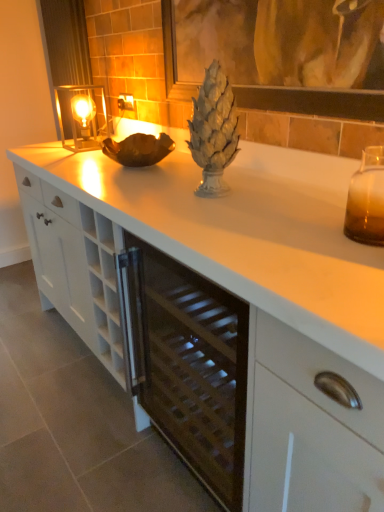
Question: Considering the positions of white matte cabinet at center and metallic silver curtain at upper left in the image, is white matte cabinet at center taller or shorter than metallic silver curtain at upper left?

Choices:
 (A) tall
 (B) short

Answer: (A)

Question: Considering the positions of white matte cabinet at center and metallic silver curtain at upper left in the image, is white matte cabinet at center wider or thinner than metallic silver curtain at upper left?

Choices:
 (A) thin
 (B) wide

Answer: (B)

Question: Which object is the farthest from the metallic glass candle holder at left, arranged as the 2th candle holder when ordered from the bottom?

Choices:
 (A) matte glass picture frame at upper center
 (B) white matte cabinet at center
 (C) metallic silver curtain at upper left
 (D) shiny metallic pineapple at center
 (E) white matte countertop at center

Answer: (B)

Question: Based on their relative distances, which object is farther from the metallic silver curtain at upper left?

Choices:
 (A) matte glass picture frame at upper center
 (B) shiny metallic pineapple at center
 (C) metallic glass candle holder at left, the first candle holder viewed from the left
 (D) white matte cabinet at center
 (E) amber glass vase at right, placed as the first candle holder when sorted from right to left

Answer: (D)